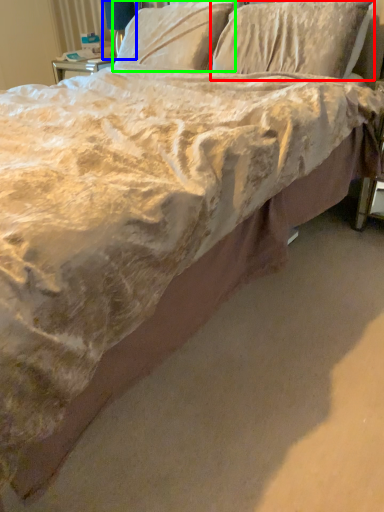
Question: Based on their relative distances, which object is farther from pillow (highlighted by a red box)? Choose from table lamp (highlighted by a blue box) and pillow (highlighted by a green box).

Choices:
 (A) table lamp
 (B) pillow

Answer: (A)